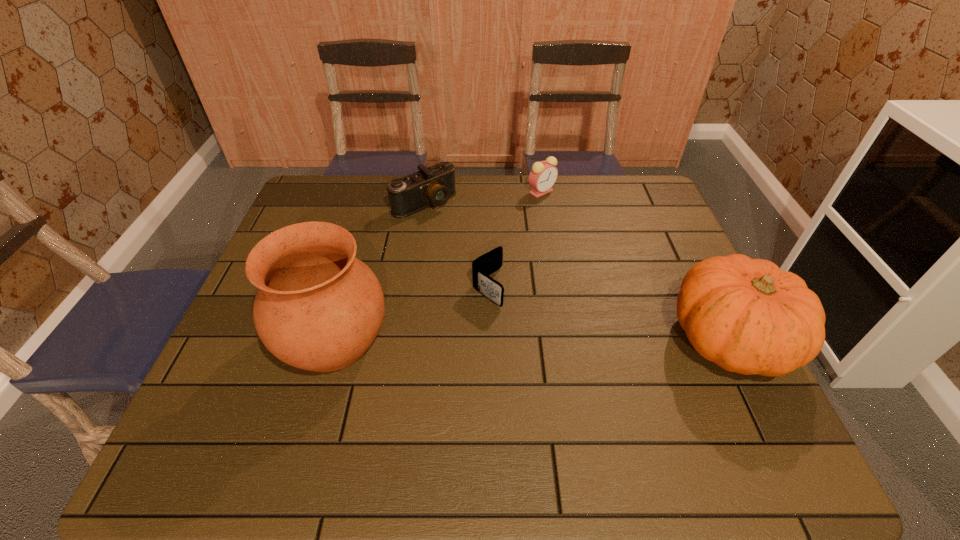
Find the location of a particular element. This screenshot has width=960, height=540. pottery is located at coordinates (318, 308).

This screenshot has width=960, height=540. Find the location of `pumpkin`. pumpkin is located at coordinates (746, 315).

The image size is (960, 540). In order to click on the rightmost object in this screenshot , I will do `click(746, 315)`.

The width and height of the screenshot is (960, 540). In order to click on the shortest object in this screenshot , I will do `click(488, 263)`.

The width and height of the screenshot is (960, 540). I want to click on wallet, so click(x=488, y=263).

Identify the location of camera. The height and width of the screenshot is (540, 960). (434, 185).

Where is `the fourth object from left to right`? the fourth object from left to right is located at coordinates (543, 175).

This screenshot has width=960, height=540. In order to click on vacant space located on the right of the pottery in this screenshot , I will do (533, 340).

Find the location of `free space located on the left of the pumpkin`. free space located on the left of the pumpkin is located at coordinates (548, 339).

Where is `vacant space located on the outer surface of the third object from right to left`? vacant space located on the outer surface of the third object from right to left is located at coordinates (553, 345).